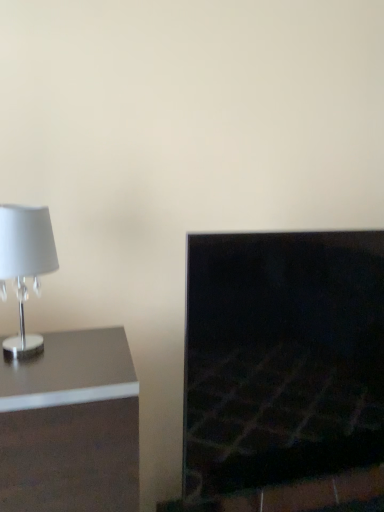
What are the coordinates of `free point below white glossy lampshade at left (from a real-world perspective)` in the screenshot? It's located at (39, 358).